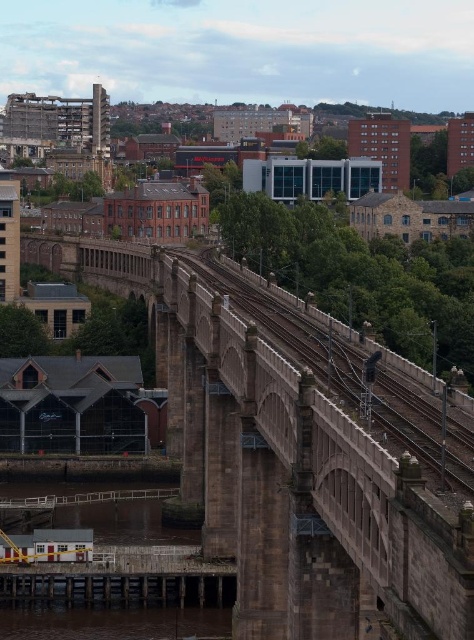
You are a civil engineer inspecting the brown stone bridge at center and the brown stone train track at center. Which structure would require more material to construct based on their sizes?

The brown stone bridge at center has a larger size compared to the brown stone train track at center, so it would require more material to construct.

You are standing at the base of the railway viaduct and want to reach a specific point marked at coordinates point (x=444, y=566). If your current position is 50 feet away from the viaduct, how much farther do you need to walk to reach the point?

The distance of point (x=444, y=566) from viewer is 136.36 feet. Since you are already 50 feet away from the viaduct, you need to walk an additional 86.36 feet to reach the point.

You are a train engineer approaching the brown stone bridge at center and the brown stone train track at center. Which structure should you be cautious of when navigating the route?

You should be cautious of the brown stone bridge at center because it is positioned under the brown stone train track at center, meaning the train will pass over it.